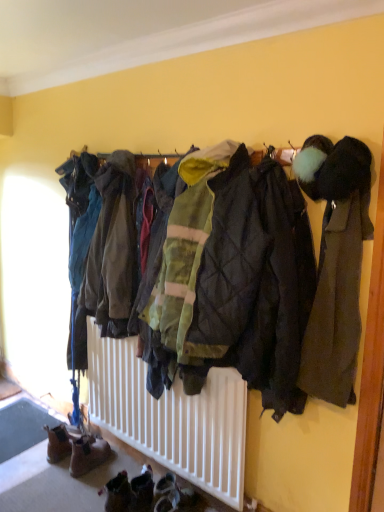
The width and height of the screenshot is (384, 512). What do you see at coordinates (112, 250) in the screenshot? I see `green quilted jacket at center, the second jacket viewed from the right` at bounding box center [112, 250].

Image resolution: width=384 pixels, height=512 pixels. Identify the location of green quilted jacket at center, which ranks as the 1th jacket in left-to-right order. point(112,250).

Is brown suede boots at lower left with green quilted jacket at center, the second jacket viewed from the right?

brown suede boots at lower left and green quilted jacket at center, the second jacket viewed from the right, are clearly separated.

Where is `footwear on the left of green quilted jacket at center, which ranks as the 1th jacket in left-to-right order`? footwear on the left of green quilted jacket at center, which ranks as the 1th jacket in left-to-right order is located at coordinates (76, 450).

Do you think brown suede boots at lower left is within green quilted jacket at center, which ranks as the second jacket in front-to-back order, or outside of it?

brown suede boots at lower left is not enclosed by green quilted jacket at center, which ranks as the second jacket in front-to-back order.

From a real-world perspective, between brown suede boots at lower left and green quilted jacket at center, the second jacket viewed from the right, who is vertically lower?

From a 3D spatial view, brown suede boots at lower left is below.

From the picture: Considering the positions of objects green quilted jacket at center, which ranks as the second jacket in front-to-back order, and brown suede boots at lower left in the image provided, who is behind, green quilted jacket at center, which ranks as the second jacket in front-to-back order, or brown suede boots at lower left?

Positioned behind is brown suede boots at lower left.

From the picture: Can you confirm if green quilted jacket at center, which ranks as the second jacket in front-to-back order, is positioned to the right of brown suede boots at lower left?

Yes.

Is green quilted jacket at center, which ranks as the second jacket in front-to-back order, facing away from brown suede boots at lower left?

No.

Considering the sizes of objects green quilted jacket at center, which ranks as the second jacket in front-to-back order, and brown suede boots at lower left in the image provided, who is smaller, green quilted jacket at center, which ranks as the second jacket in front-to-back order, or brown suede boots at lower left?

brown suede boots at lower left is smaller.

Which is more to the right, dark gray wool coat at right, the 1th jacket from the right, or green quilted jacket at center, which ranks as the second jacket in front-to-back order?

dark gray wool coat at right, the 1th jacket from the right.

Is green quilted jacket at center, which ranks as the second jacket in front-to-back order, a part of dark gray wool coat at right, which is counted as the 1th jacket, starting from the front?

No, dark gray wool coat at right, which is counted as the 1th jacket, starting from the front, does not contain green quilted jacket at center, which ranks as the second jacket in front-to-back order.

How many degrees apart are the facing directions of dark gray wool coat at right, which is counted as the 1th jacket, starting from the front, and green quilted jacket at center, the first jacket positioned from the back?

There is a 0.0024-degree angle between the facing directions of dark gray wool coat at right, which is counted as the 1th jacket, starting from the front, and green quilted jacket at center, the first jacket positioned from the back.

Is brown suede boots at lower left completely or partially outside of dark gray wool coat at right, which is the 2th jacket from left to right?

Yes.

Looking at this image, does brown suede boots at lower left have a greater width compared to dark gray wool coat at right, which is the 2th jacket from back to front?

Yes, brown suede boots at lower left is wider than dark gray wool coat at right, which is the 2th jacket from back to front.

Can you tell me how much brown suede boots at lower left and dark gray wool coat at right, which is the 2th jacket from back to front, differ in facing direction?

The angular difference between brown suede boots at lower left and dark gray wool coat at right, which is the 2th jacket from back to front, is 0.00493 degrees.

Does brown suede boots at lower left appear on the left side of dark gray wool coat at right, the 1th jacket from the right?

Yes, brown suede boots at lower left is to the left of dark gray wool coat at right, the 1th jacket from the right.

Between green quilted jacket at center, the second jacket viewed from the right, and dark gray wool coat at right, the 1th jacket from the right, which one has more height?

green quilted jacket at center, the second jacket viewed from the right, is taller.

Does point (118, 185) lie behind point (351, 247)?

That is True.

How many degrees apart are the facing directions of green quilted jacket at center, the second jacket viewed from the right, and dark gray wool coat at right, which is the 2th jacket from back to front?

green quilted jacket at center, the second jacket viewed from the right, and dark gray wool coat at right, which is the 2th jacket from back to front, are facing 0.0024 degrees away from each other.

From a real-world perspective, does dark gray wool coat at right, the 1th jacket from the right, sit lower than brown suede boots at lower left?

Actually, dark gray wool coat at right, the 1th jacket from the right, is physically above brown suede boots at lower left in the real world.

Looking at the image, does dark gray wool coat at right, which is the 2th jacket from left to right, seem bigger or smaller compared to brown suede boots at lower left?

In the image, dark gray wool coat at right, which is the 2th jacket from left to right, appears to be larger than brown suede boots at lower left.

Is dark gray wool coat at right, the 1th jacket from the right, directly adjacent to brown suede boots at lower left?

They are not placed beside each other.

Which is behind, point (309, 368) or point (51, 455)?

The point (51, 455) is farther.

This screenshot has height=512, width=384. Identify the location of footwear below the green quilted jacket at center, which ranks as the 1th jacket in left-to-right order (from a real-world perspective). (76, 450).

There is a brown suede boots at lower left. Identify the location of the 2nd jacket above it (from the image's perspective). (112, 250).

Consider the image. Looking at the image, which one is located further to dark gray wool coat at right, which is counted as the 1th jacket, starting from the front, green quilted jacket at center, which ranks as the 1th jacket in left-to-right order, or brown suede boots at lower left?

brown suede boots at lower left.

When comparing their distances from green quilted jacket at center, the second jacket viewed from the right, does dark gray wool coat at right, the 1th jacket from the right, or brown suede boots at lower left seem further?

The object further to green quilted jacket at center, the second jacket viewed from the right, is brown suede boots at lower left.

Considering their positions, is dark gray wool coat at right, which is the 2th jacket from back to front, positioned closer to brown suede boots at lower left than green quilted jacket at center, which ranks as the second jacket in front-to-back order?

green quilted jacket at center, which ranks as the second jacket in front-to-back order, lies closer to brown suede boots at lower left than the other object.

From the picture: Looking at the image, which one is located closer to brown suede boots at lower left, green quilted jacket at center, which ranks as the second jacket in front-to-back order, or dark gray wool coat at right, which is counted as the 1th jacket, starting from the front?

green quilted jacket at center, which ranks as the second jacket in front-to-back order, lies closer to brown suede boots at lower left than the other object.

Which object lies nearer to the anchor point green quilted jacket at center, the first jacket positioned from the back, brown suede boots at lower left or dark gray wool coat at right, which is the 2th jacket from left to right?

dark gray wool coat at right, which is the 2th jacket from left to right, is positioned closer to the anchor green quilted jacket at center, the first jacket positioned from the back.

From the image, which object appears to be farther from dark gray wool coat at right, the 1th jacket from the right, brown suede boots at lower left or green quilted jacket at center, the second jacket viewed from the right?

brown suede boots at lower left is positioned further to the anchor dark gray wool coat at right, the 1th jacket from the right.

In order to click on jacket between green quilted jacket at center, the second jacket viewed from the right, and brown suede boots at lower left in the up-down direction in this screenshot , I will do `click(335, 263)`.